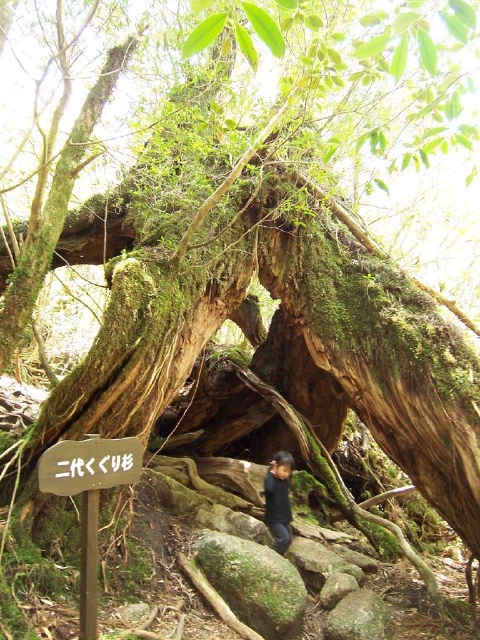
Question: Where is green mossy rock at lower center located in relation to green mossy rock at center in the image?

Choices:
 (A) left
 (B) right

Answer: (A)

Question: Can you confirm if wooden sign at center is positioned below green mossy rock at center?

Choices:
 (A) no
 (B) yes

Answer: (A)

Question: Which point appears closest to the camera in this image?

Choices:
 (A) (226, 548)
 (B) (69, 452)

Answer: (B)

Question: Based on their relative distances, which object is nearer to the green mossy rock at center?

Choices:
 (A) wooden sign at center
 (B) green mossy rock at lower center

Answer: (B)

Question: Which of the following is the closest to the observer?

Choices:
 (A) (x=62, y=484)
 (B) (x=289, y=525)

Answer: (A)

Question: In this image, where is green mossy rock at lower center located relative to dark blue fabric at lower center?

Choices:
 (A) left
 (B) right

Answer: (A)